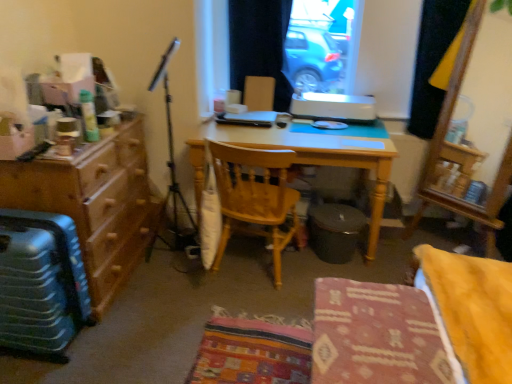
Question: Is patterned fabric chair at center, arranged as the 1th chair when viewed from the front, closer to camera compared to light wood desk at center?

Choices:
 (A) no
 (B) yes

Answer: (B)

Question: Is patterned fabric chair at center, marked as the 2th chair in a back-to-front arrangement, looking in the opposite direction of light wood desk at center?

Choices:
 (A) no
 (B) yes

Answer: (A)

Question: From the image's perspective, is patterned fabric chair at center, marked as the 2th chair in a back-to-front arrangement, over light wood desk at center?

Choices:
 (A) no
 (B) yes

Answer: (A)

Question: Is patterned fabric chair at center, arranged as the 1th chair when viewed from the front, smaller than light wood desk at center?

Choices:
 (A) no
 (B) yes

Answer: (B)

Question: Is patterned fabric chair at center, marked as the 2th chair in a back-to-front arrangement, taller than light wood desk at center?

Choices:
 (A) no
 (B) yes

Answer: (A)

Question: Does patterned fabric chair at center, arranged as the 1th chair when viewed from the front, have a greater width compared to light wood desk at center?

Choices:
 (A) yes
 (B) no

Answer: (B)

Question: Would you say patterned fabric chair at center, arranged as the 1th chair when viewed from the front, is outside black fabric curtain at upper right, which is counted as the 1th curtain, starting from the right?

Choices:
 (A) no
 (B) yes

Answer: (B)

Question: Does patterned fabric chair at center, arranged as the 1th chair when viewed from the front, have a larger size compared to black fabric curtain at upper right, which is counted as the 1th curtain, starting from the right?

Choices:
 (A) yes
 (B) no

Answer: (B)

Question: Can you confirm if patterned fabric chair at center, arranged as the 1th chair when viewed from the front, is shorter than black fabric curtain at upper right, acting as the second curtain starting from the left?

Choices:
 (A) yes
 (B) no

Answer: (A)

Question: Can you confirm if patterned fabric chair at center, marked as the 2th chair in a back-to-front arrangement, is wider than black fabric curtain at upper right, which is counted as the 1th curtain, starting from the right?

Choices:
 (A) yes
 (B) no

Answer: (A)

Question: Could you tell me if patterned fabric chair at center, arranged as the 1th chair when viewed from the front, is facing black fabric curtain at upper right, acting as the second curtain starting from the left?

Choices:
 (A) yes
 (B) no

Answer: (B)

Question: Is patterned fabric chair at center, arranged as the 1th chair when viewed from the front, at the left side of black fabric curtain at upper right, acting as the second curtain starting from the left?

Choices:
 (A) no
 (B) yes

Answer: (B)

Question: Is light wood desk at center next to black fabric curtain at upper center, which is the first curtain in left-to-right order?

Choices:
 (A) yes
 (B) no

Answer: (B)